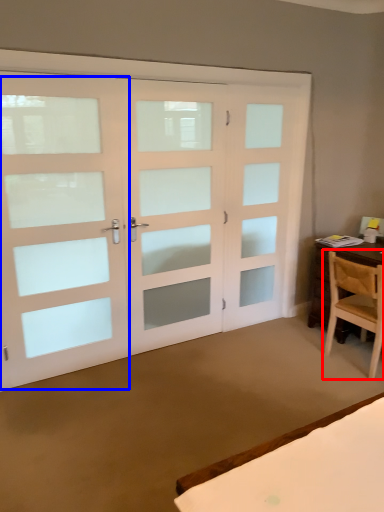
Question: Which point is further to the camera, chair (highlighted by a red box) or screen door (highlighted by a blue box)?

Choices:
 (A) chair
 (B) screen door

Answer: (A)